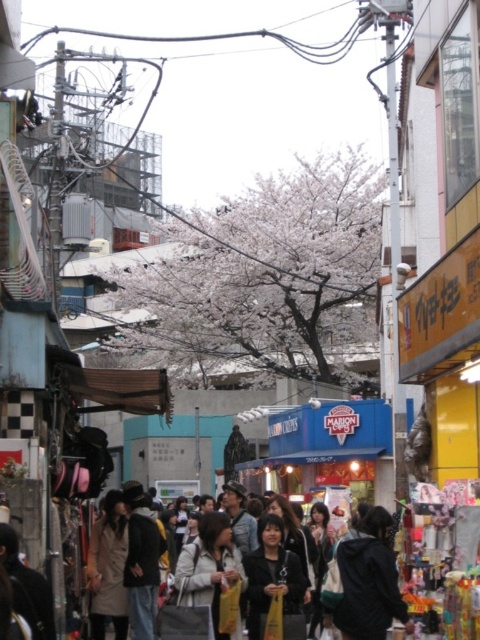
Is dark gray fabric crowd at center above dark gray hoodie at center?

Indeed, dark gray fabric crowd at center is positioned over dark gray hoodie at center.

Describe the element at coordinates (365, 579) in the screenshot. I see `dark gray fabric crowd at center` at that location.

Locate an element on the screen. Image resolution: width=480 pixels, height=640 pixels. dark gray fabric crowd at center is located at coordinates (365, 579).

Is dark gray fabric crowd at center bigger than light beige jacket at center?

Yes, dark gray fabric crowd at center is bigger than light beige jacket at center.

Between point (250, 632) and point (220, 572), which one is positioned in front?

Point (250, 632) is in front.

The height and width of the screenshot is (640, 480). Find the location of `dark gray fabric crowd at center`. dark gray fabric crowd at center is located at coordinates (365, 579).

Who is more distant from viewer, (x=387, y=534) or (x=212, y=529)?

Point (x=212, y=529)

Who is higher up, dark gray hoodie at center or light beige jacket at center?

Positioned higher is dark gray hoodie at center.

Is point (357, 550) positioned before point (204, 518)?

That is True.

This screenshot has height=640, width=480. Identify the location of dark gray hoodie at center. (369, 579).